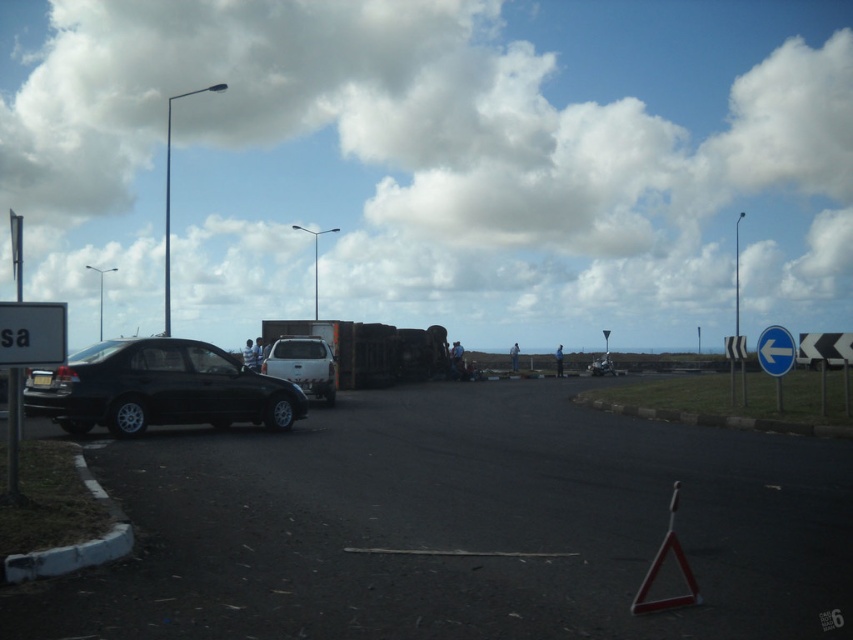
You are a driver approaching the scene. You see the white matte truck at center and the blue plastic sign at right. Which object takes up more visual space in your view?

The blue plastic sign at right takes up more visual space than the white matte truck at center because the white matte truck at center occupies less space than blue plastic sign at right.

You are a driver approaching the scene and see the white fluffy cloud at upper center and the white matte truck at center. Which object is higher in the image?

The white fluffy cloud at upper center is positioned over the white matte truck at center, so it is higher in the image.

You are a driver approaching the scene and notice the white fluffy cloud at upper center and the white matte truck at center. Which object in the scene is wider?

The white fluffy cloud at upper center is wider than the white matte truck at center.